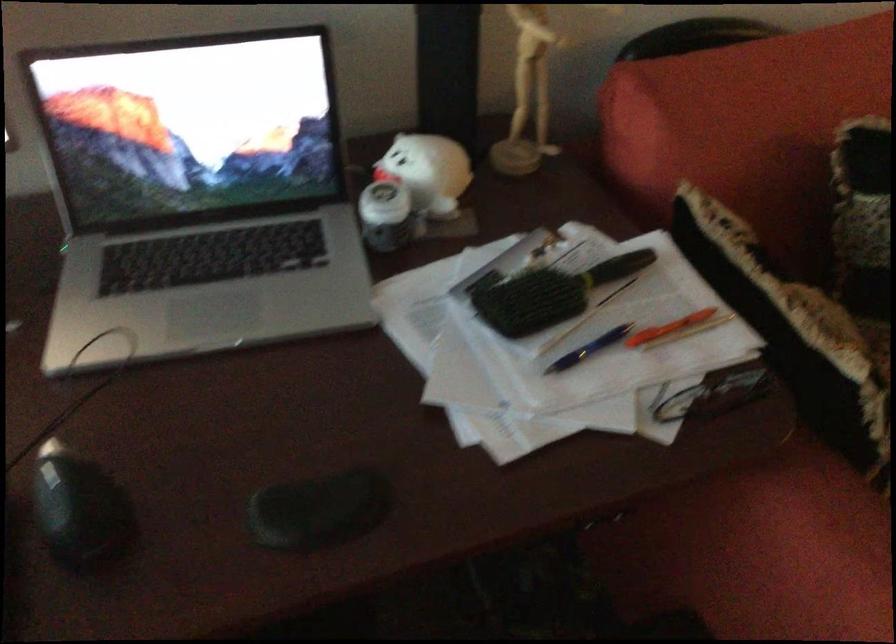
The height and width of the screenshot is (644, 896). What do you see at coordinates (616, 267) in the screenshot?
I see `the hairbrush handle` at bounding box center [616, 267].